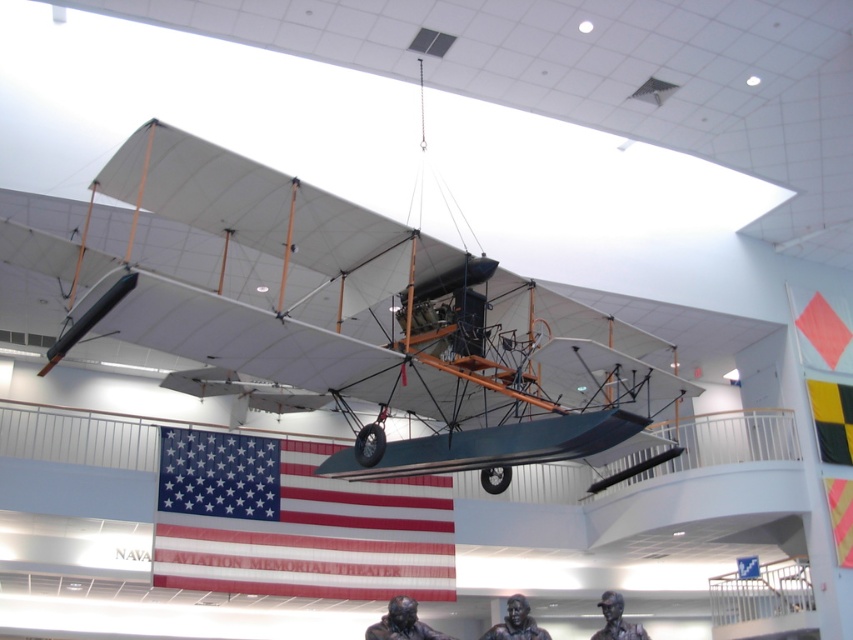
Who is shorter, matte white airplane at center or american flag at center?

Standing shorter between the two is american flag at center.

Is point (543, 307) closer to camera compared to point (293, 465)?

Yes, point (543, 307) is closer to viewer.

Is point (260, 298) farther from camera compared to point (332, 586)?

Yes, point (260, 298) is behind point (332, 586).

This screenshot has height=640, width=853. I want to click on matte white airplane at center, so click(329, 310).

How far apart are american flag at center and yellowmaterial/textureflag at upper right?

The distance of american flag at center from yellowmaterial/textureflag at upper right is 50.12 feet.

Is american flag at center wider than yellowmaterial/textureflag at upper right?

No, american flag at center is not wider than yellowmaterial/textureflag at upper right.

Find the location of `american flag at center`. american flag at center is located at coordinates (294, 522).

Does point (460, 372) come closer to viewer compared to point (824, 435)?

Yes, it is in front of point (824, 435).

From the picture: Can you confirm if matte white airplane at center is wider than yellowmaterial/textureflag at upper right?

Yes.

Measure the distance between matte white airplane at center and camera.

A distance of 8.84 meters exists between matte white airplane at center and camera.

Where is `matte white airplane at center`? The width and height of the screenshot is (853, 640). matte white airplane at center is located at coordinates pos(329,310).